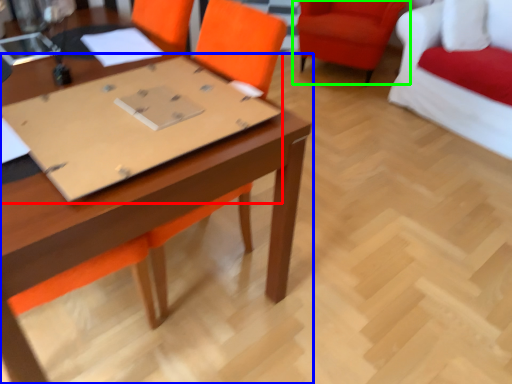
Question: Which object is the closest to the cardboard (highlighted by a red box)? Choose among these: table (highlighted by a blue box) or chair (highlighted by a green box).

Choices:
 (A) table
 (B) chair

Answer: (A)